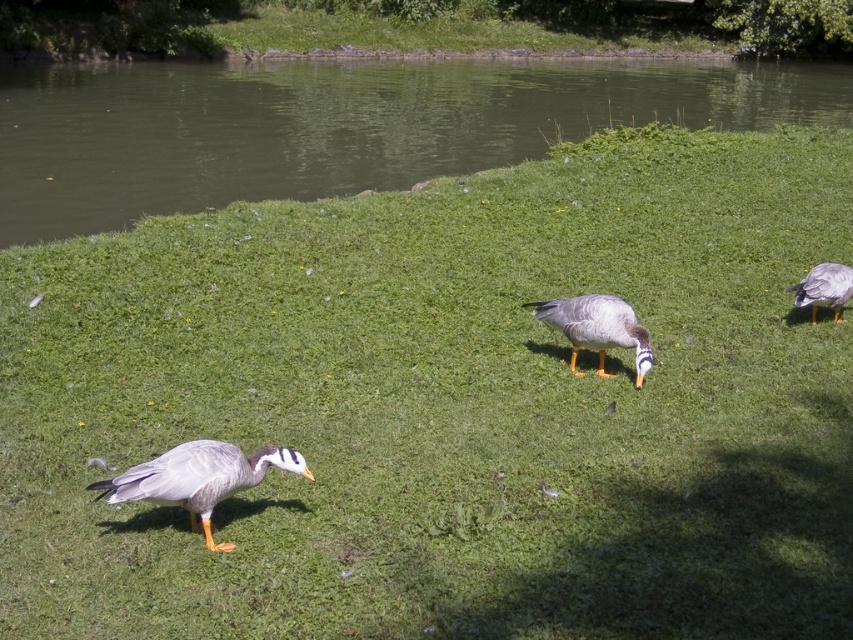
Is green water at center closer to the viewer compared to gray matte goose at lower left?

That is False.

This screenshot has width=853, height=640. What do you see at coordinates (339, 125) in the screenshot? I see `green water at center` at bounding box center [339, 125].

Is point (224, 148) in front of point (227, 541)?

No, (224, 148) is behind (227, 541).

Locate an element on the screen. green water at center is located at coordinates (339, 125).

Does gray matte goose at lower left lie behind gray matte duck at center?

No, gray matte goose at lower left is closer to the viewer.

Who is more distant from viewer, (289, 454) or (619, 339)?

Point (619, 339)

Where is `gray matte goose at lower left`? gray matte goose at lower left is located at coordinates 199,477.

The height and width of the screenshot is (640, 853). Describe the element at coordinates (339, 125) in the screenshot. I see `green water at center` at that location.

Does green water at center have a larger size compared to gray matte duck at right?

Indeed, green water at center has a larger size compared to gray matte duck at right.

At what (x,y) coordinates should I click in order to perform the action: click on green water at center. Please return your answer as a coordinate pair (x, y). Looking at the image, I should click on (339, 125).